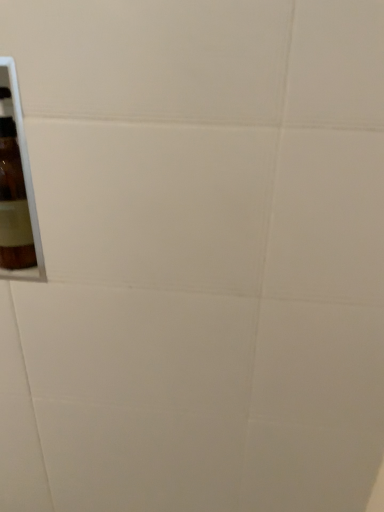
The width and height of the screenshot is (384, 512). I want to click on translucent glass bottle at left, so click(13, 196).

The height and width of the screenshot is (512, 384). Describe the element at coordinates (13, 196) in the screenshot. I see `translucent glass bottle at left` at that location.

The image size is (384, 512). In order to click on translucent glass bottle at left in this screenshot , I will do `click(13, 196)`.